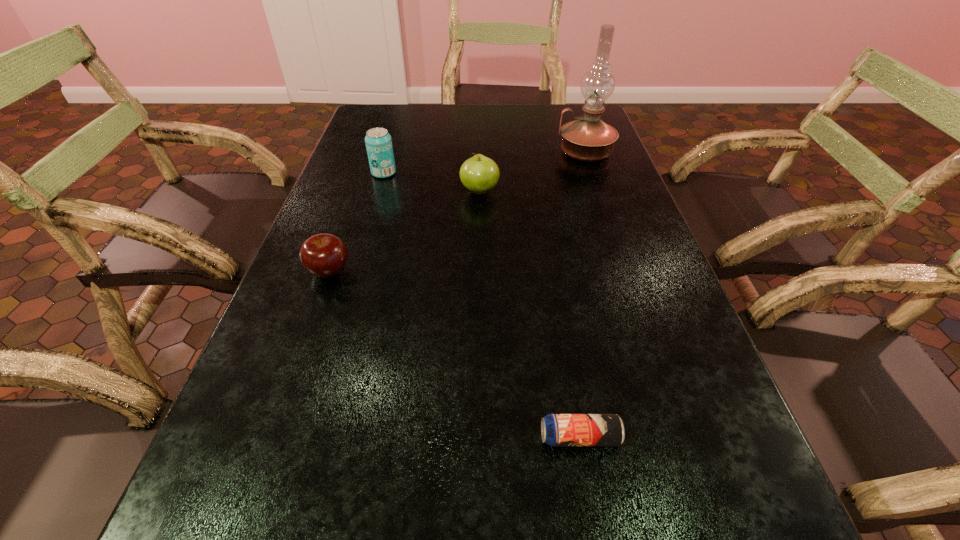
The width and height of the screenshot is (960, 540). Find the location of `free spot located on the back of the tallest object`. free spot located on the back of the tallest object is located at coordinates (570, 109).

Where is `free space located on the left of the taller beer can`? free space located on the left of the taller beer can is located at coordinates (347, 173).

Find the location of `free space located on the front of the farther apple`. free space located on the front of the farther apple is located at coordinates (479, 272).

Locate an element on the screen. blank area located on the right of the left apple is located at coordinates (472, 272).

Identify the location of free space located 0.100m on the back of the second object from right to left. (568, 370).

The width and height of the screenshot is (960, 540). I want to click on beer can present at the left edge, so click(378, 141).

Locate an element on the screen. apple that is at the left edge is located at coordinates [x=324, y=255].

Where is `object at the right edge`? object at the right edge is located at coordinates (588, 138).

I want to click on vacant space at the left edge, so click(302, 298).

Locate an element on the screen. This screenshot has width=960, height=540. vacant space at the right edge of the desktop is located at coordinates (591, 231).